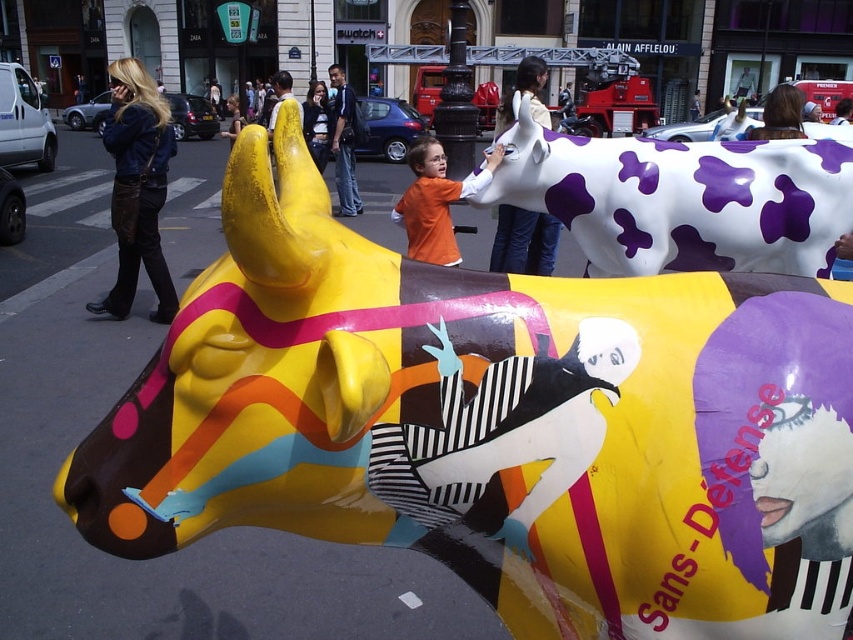
Which is more to the right, orange matte shirt at center or brown hair at upper right?

Positioned to the right is brown hair at upper right.

Which of these two, orange matte shirt at center or brown hair at upper right, stands shorter?

orange matte shirt at center is shorter.

What do you see at coordinates (436, 202) in the screenshot? I see `orange matte shirt at center` at bounding box center [436, 202].

Identify the location of orange matte shirt at center. This screenshot has height=640, width=853. (436, 202).

Between brown hair at upper right and smooth brown leather jacket at upper right, which one appears on the left side from the viewer's perspective?

Positioned to the left is brown hair at upper right.

Who is shorter, brown hair at upper right or smooth brown leather jacket at upper right?

smooth brown leather jacket at upper right

Does point (788, 113) come behind point (844, 99)?

No, it is in front of (844, 99).

This screenshot has height=640, width=853. Identify the location of brown hair at upper right. (780, 115).

Based on the photo, does white glossy cow at center appear on the left side of yellow fabric shirt at center?

Incorrect, white glossy cow at center is not on the left side of yellow fabric shirt at center.

Which is in front, point (625, 241) or point (277, 83)?

Point (625, 241) is more forward.

The width and height of the screenshot is (853, 640). Identify the location of white glossy cow at center. (682, 198).